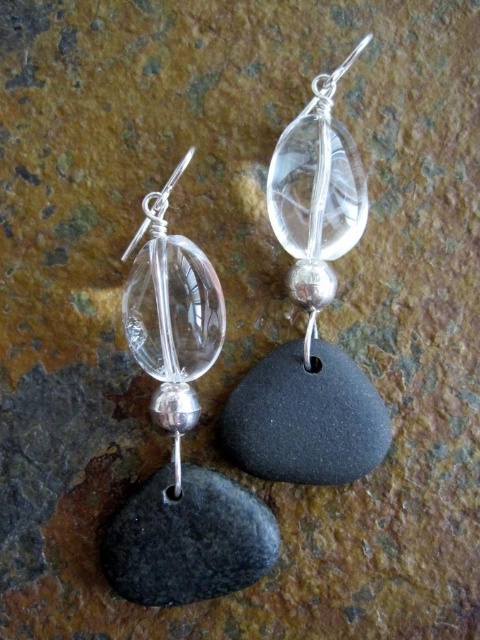
Question: Which point appears closest to the camera in this image?

Choices:
 (A) (238, 486)
 (B) (280, 387)
 (C) (278, 403)
 (D) (199, 548)

Answer: (D)

Question: Does black matte stone at center have a smaller size compared to black matte stone at lower left?

Choices:
 (A) yes
 (B) no

Answer: (A)

Question: Considering the real-world distances, which object is closest to the black matte stone at center?

Choices:
 (A) clear glass stone at lower left
 (B) black matte stone at lower left

Answer: (A)

Question: Is clear glass stone at center positioned before black matte stone at center?

Choices:
 (A) no
 (B) yes

Answer: (B)

Question: Considering the real-world distances, which object is closest to the clear glass stone at lower left?

Choices:
 (A) clear glass stone at center
 (B) black matte stone at lower left
 (C) black matte stone at center

Answer: (B)

Question: Is black matte stone at center positioned in front of black matte stone at lower left?

Choices:
 (A) no
 (B) yes

Answer: (A)